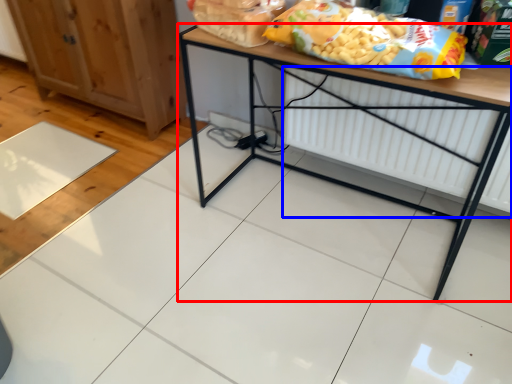
Question: Which point is closer to the camera, table (highlighted by a red box) or radiator (highlighted by a blue box)?

Choices:
 (A) table
 (B) radiator

Answer: (A)